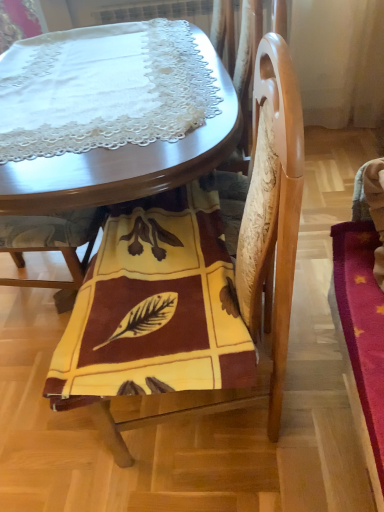
You are a GUI agent. You are given a task and a screenshot of the screen. Output one action in this format:
    pyautogui.click(x=<x>, y=<y>)
    Task: Click on the vacant region to the right of yellow woolen blanket at center, which is the 2th chair from left to right
    The width and height of the screenshot is (384, 512).
    Given the screenshot: What is the action you would take?
    tap(316, 380)